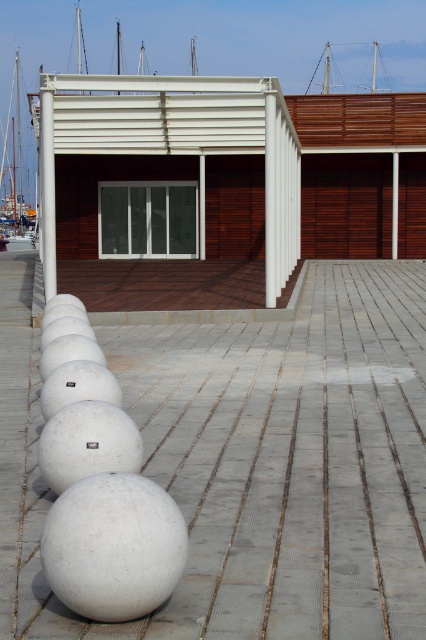
Question: Which point is farther to the camera?

Choices:
 (A) (106, 228)
 (B) (9, 113)

Answer: (B)

Question: Among these points, which one is nearest to the camera?

Choices:
 (A) (5, 129)
 (B) (178, 228)

Answer: (B)

Question: Which of the following is the closest to the observer?

Choices:
 (A) transparent glass door at center
 (B) white glossy boat at left

Answer: (A)

Question: Is transparent glass door at center below white glossy boat at left?

Choices:
 (A) no
 (B) yes

Answer: (B)

Question: Does transparent glass door at center appear over white glossy boat at left?

Choices:
 (A) no
 (B) yes

Answer: (A)

Question: Can you confirm if transparent glass door at center is thinner than white glossy boat at left?

Choices:
 (A) yes
 (B) no

Answer: (A)